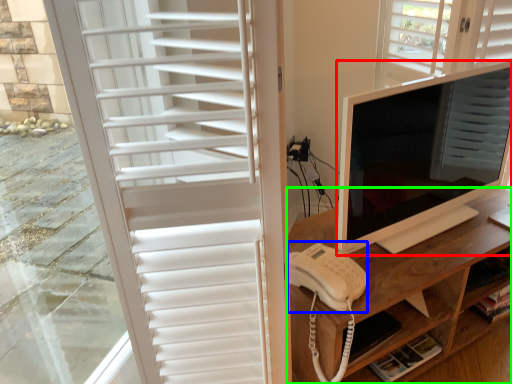
Question: Which is nearer to the computer monitor (highlighted by a red box)? open (highlighted by a blue box) or desk (highlighted by a green box).

Choices:
 (A) open
 (B) desk

Answer: (B)